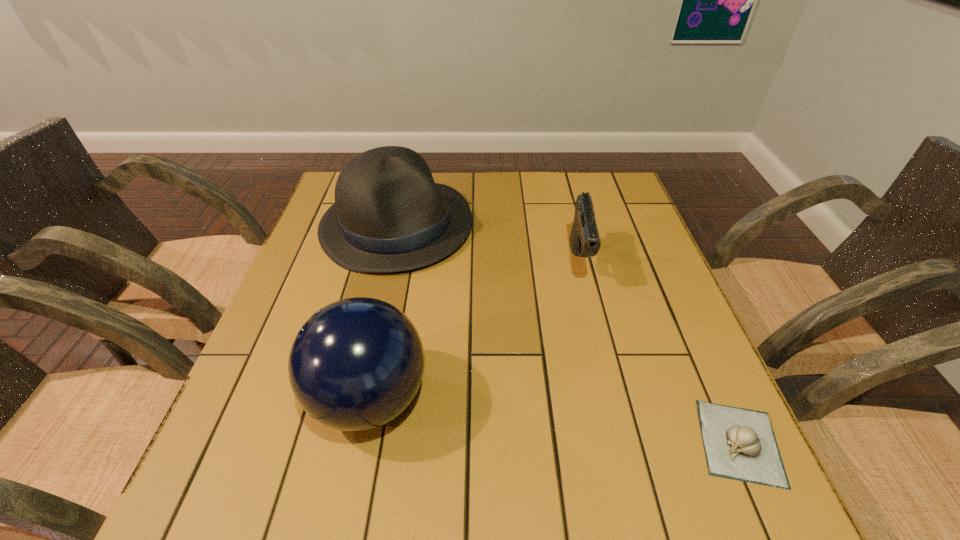
Where is `vacant space on the desktop that is between the bowling ball and the rightmost object and is positioned on the front-facing side of the bowler hat`? vacant space on the desktop that is between the bowling ball and the rightmost object and is positioned on the front-facing side of the bowler hat is located at coordinates (602, 426).

The image size is (960, 540). Identify the location of vacant spot on the desktop that is between the bowling ball and the shortest object and is positioned at the barrel of the third object from left to right. (602, 426).